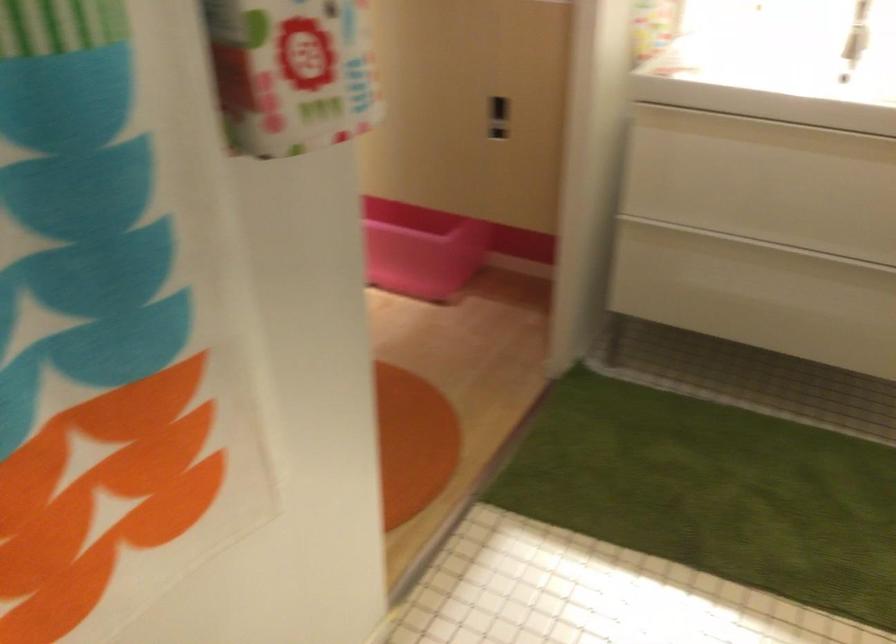
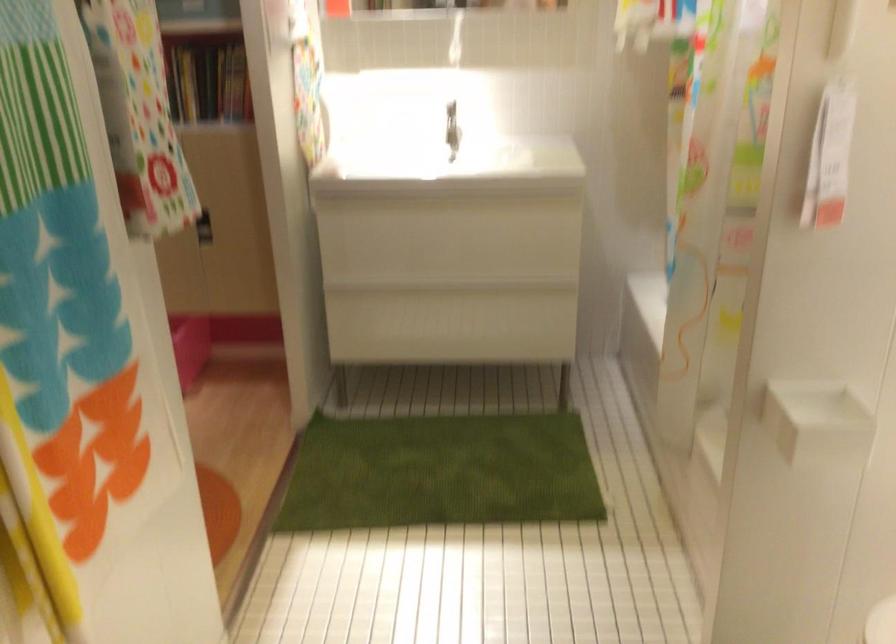
Question: Based on the continuous images, in which direction is the camera rotating? Reply with the corresponding letter.

Choices:
 (A) Left
 (B) Right
 (C) Up
 (D) Down

Answer: (B)